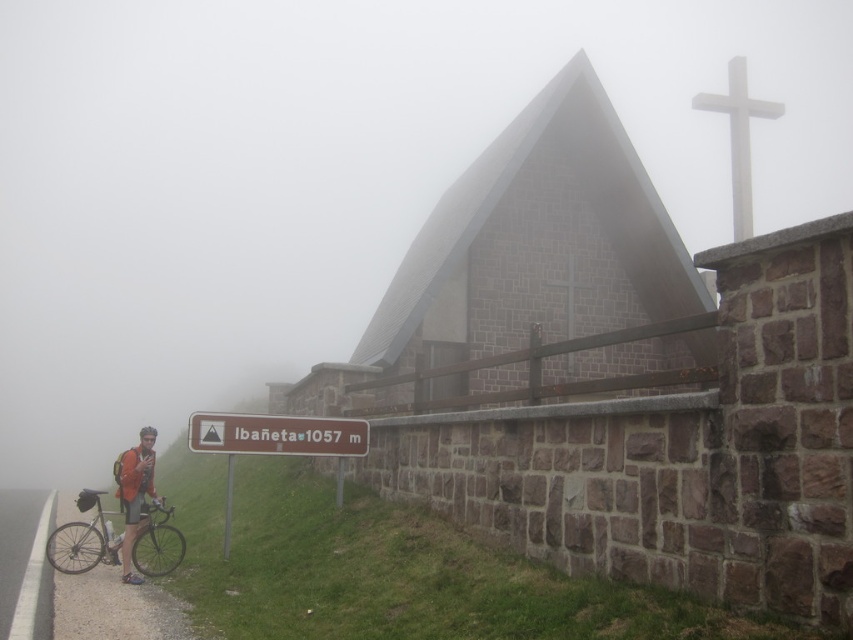
Question: Observing the image, what is the correct spatial positioning of gray stone church at center in reference to silver metallic bicycle at lower left?

Choices:
 (A) above
 (B) below

Answer: (A)

Question: Which of the following is the closest to the observer?

Choices:
 (A) matte orange jacket at lower left
 (B) silver metallic bicycle at lower left
 (C) white stone cross at upper right
 (D) brown stone sign at lower center

Answer: (C)

Question: Does brown stone sign at lower center appear on the right side of silver metallic bicycle at lower left?

Choices:
 (A) no
 (B) yes

Answer: (B)

Question: Which object is the farthest from the gray stone church at center?

Choices:
 (A) matte orange jacket at lower left
 (B) white stone cross at upper right
 (C) brown stone sign at lower center
 (D) silver metallic bicycle at lower left

Answer: (A)

Question: Which point is farther to the camera?

Choices:
 (A) brown stone sign at lower center
 (B) matte orange jacket at lower left
 (C) white stone cross at upper right
 (D) silver metallic bicycle at lower left

Answer: (B)

Question: Is gray stone church at center closer to camera compared to brown stone sign at lower center?

Choices:
 (A) yes
 (B) no

Answer: (A)